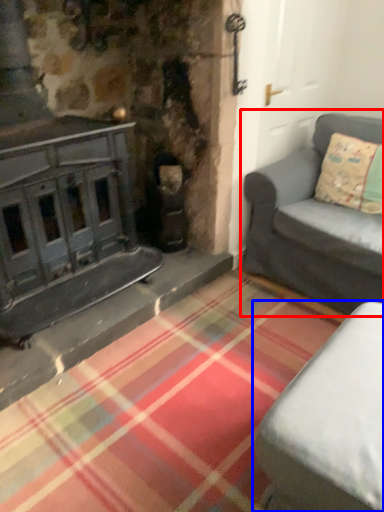
Question: Which of the following is the farthest to the observer, studio couch (highlighted by a red box) or studio couch (highlighted by a blue box)?

Choices:
 (A) studio couch
 (B) studio couch

Answer: (A)